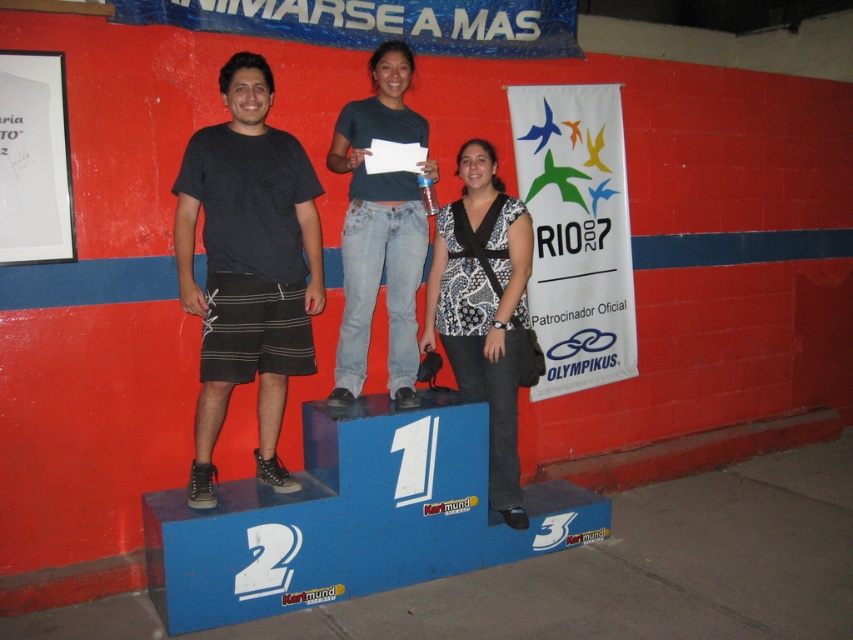
Question: Which point is closer to the camera taking this photo?

Choices:
 (A) (456, 260)
 (B) (198, 163)
 (C) (358, 186)

Answer: (B)

Question: Is black cotton t-shirt at center smaller than jeans at center?

Choices:
 (A) yes
 (B) no

Answer: (B)

Question: Is black cotton t-shirt at center behind jeans at center?

Choices:
 (A) yes
 (B) no

Answer: (B)

Question: Is patterned fabric blouse at center below jeans at center?

Choices:
 (A) no
 (B) yes

Answer: (B)

Question: Which object appears farthest from the camera in this image?

Choices:
 (A) jeans at center
 (B) patterned fabric blouse at center

Answer: (B)

Question: Which of the following is the farthest from the observer?

Choices:
 (A) black cotton t-shirt at center
 (B) jeans at center

Answer: (B)